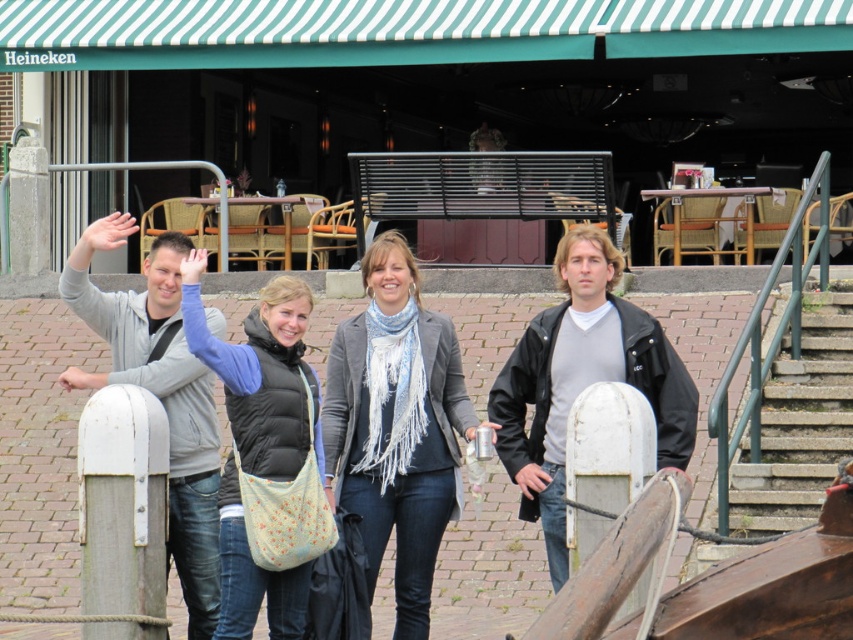
You are a photographer trying to focus on the light blue quilted vest at center and the light skin tone hand at center in the image. Which object should you adjust your camera focus on first to ensure both are in focus?

Since the light blue quilted vest at center is closer to the viewer than the light skin tone hand at center, you should focus on the light blue quilted vest at center first. This way, the depth of field will naturally cover the hand further back, ensuring both are in focus.

You are a photographer trying to capture a closeup of the gray wool scarf at center without any obstructions. Given the current arrangement, will the white matte hand at upper left block the view of the scarf?

The gray wool scarf at center is located below the white matte hand at upper left, so the hand will block the view of the scarf from this angle.